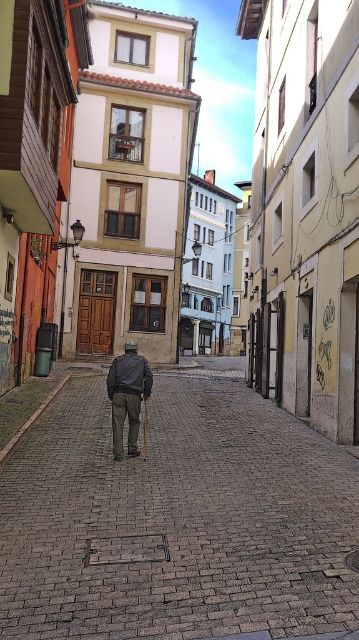
You are a delivery person trying to navigate through the narrow cobblestone street. You see the brown brick pavement at center and the dark gray fabric jacket at center. Which object is wider from your perspective?

The brown brick pavement at center is wider than the dark gray fabric jacket at center according to the description.

You are standing at the point marked as point (175, 516) in the image. What is located exactly at this point?

The point (175, 516) is exactly where the brown brick pavement at center is located.

You are a tourist standing on the brown brick pavement at center and want to take a photo of the dark gray fabric jacket at center. Which direction should you move to get a better shot?

The brown brick pavement at center is to the right of the dark gray fabric jacket at center, so you should move to the left to position yourself closer to the jacket.